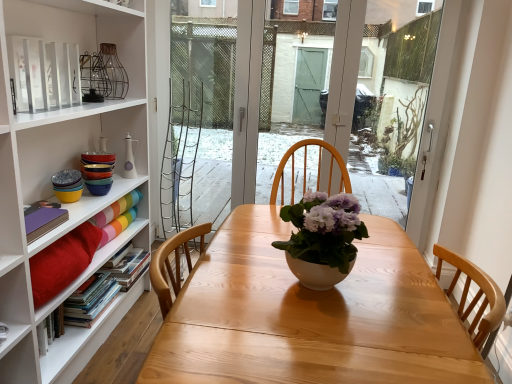
Question: Should I look upward or downward to see purple matte book at left, the third book ordered from the bottom?

Choices:
 (A) up
 (B) down

Answer: (B)

Question: From a real-world perspective, is white matte vase at center located beneath hardcover books at left, the 2th book ordered from the bottom?

Choices:
 (A) no
 (B) yes

Answer: (A)

Question: Is white matte vase at center located outside hardcover books at left, the 2th book ordered from the bottom?

Choices:
 (A) yes
 (B) no

Answer: (A)

Question: Considering the relative sizes of white matte vase at center and hardcover books at left, the 2th book ordered from the bottom, in the image provided, is white matte vase at center smaller than hardcover books at left, the 2th book ordered from the bottom,?

Choices:
 (A) no
 (B) yes

Answer: (A)

Question: Does white matte vase at center have a greater height compared to hardcover books at left, the 2th book ordered from the bottom?

Choices:
 (A) no
 (B) yes

Answer: (B)

Question: Considering the relative sizes of white matte vase at center and hardcover books at left, arranged as the 3th book when viewed from the top, in the image provided, is white matte vase at center thinner than hardcover books at left, arranged as the 3th book when viewed from the top,?

Choices:
 (A) no
 (B) yes

Answer: (A)

Question: Would you say hardcover books at left, arranged as the 3th book when viewed from the top, is part of white matte vase at center's contents?

Choices:
 (A) yes
 (B) no

Answer: (B)

Question: From a real-world perspective, is matte rainbow paper at left, which ranks as the 4th book in bottom-to-top order, under matte white vase at upper left?

Choices:
 (A) yes
 (B) no

Answer: (A)

Question: Does matte rainbow paper at left, the first book from the top, contain matte white vase at upper left?

Choices:
 (A) no
 (B) yes

Answer: (A)

Question: Is matte white vase at upper left at the back of matte rainbow paper at left, the first book from the top?

Choices:
 (A) yes
 (B) no

Answer: (B)

Question: From the image's perspective, is matte rainbow paper at left, the first book from the top, on top of matte white vase at upper left?

Choices:
 (A) yes
 (B) no

Answer: (B)

Question: Considering the relative positions of matte rainbow paper at left, which ranks as the 4th book in bottom-to-top order, and matte white vase at upper left in the image provided, is matte rainbow paper at left, which ranks as the 4th book in bottom-to-top order, to the right of matte white vase at upper left from the viewer's perspective?

Choices:
 (A) yes
 (B) no

Answer: (B)

Question: Can you confirm if matte rainbow paper at left, the first book from the top, is thinner than matte white vase at upper left?

Choices:
 (A) no
 (B) yes

Answer: (A)

Question: Is matte rainbow paper at left, the first book from the top, touching hardcover books at left, the 2th book ordered from the bottom?

Choices:
 (A) yes
 (B) no

Answer: (B)